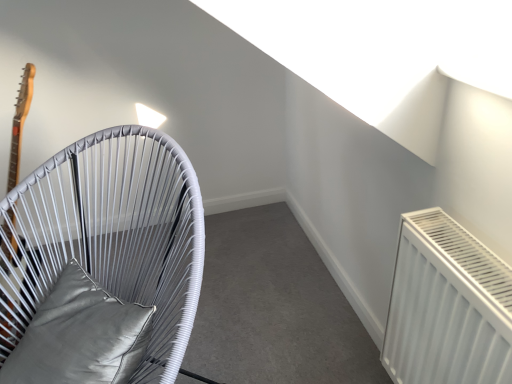
The height and width of the screenshot is (384, 512). I want to click on satin gray pillow at left, so click(80, 336).

What do you see at coordinates (80, 336) in the screenshot? Image resolution: width=512 pixels, height=384 pixels. I see `satin gray pillow at left` at bounding box center [80, 336].

The height and width of the screenshot is (384, 512). Identify the location of white woven chair at left. (109, 237).

The height and width of the screenshot is (384, 512). Describe the element at coordinates (109, 237) in the screenshot. I see `white woven chair at left` at that location.

Find the location of a particular element. The height and width of the screenshot is (384, 512). satin gray pillow at left is located at coordinates (80, 336).

Does satin gray pillow at left appear on the right side of white woven chair at left?

Yes, satin gray pillow at left is to the right of white woven chair at left.

Looking at this image, considering their positions, is satin gray pillow at left located in front of or behind white woven chair at left?

Visually, satin gray pillow at left is located behind white woven chair at left.

Which is closer, (1,371) or (179,306)?

Point (179,306)

From the image's perspective, is satin gray pillow at left located above or below white woven chair at left?

Clearly, from the image's perspective, satin gray pillow at left is below white woven chair at left.

From a real-world perspective, is satin gray pillow at left located higher than white woven chair at left?

Yes, from a real-world perspective, satin gray pillow at left is above white woven chair at left.

Between satin gray pillow at left and white woven chair at left, which one has larger width?

Wider between the two is white woven chair at left.

Who is shorter, satin gray pillow at left or white woven chair at left?

Standing shorter between the two is satin gray pillow at left.

Does satin gray pillow at left have a larger size compared to white woven chair at left?

No, satin gray pillow at left is not bigger than white woven chair at left.

Is white woven chair at left completely or partially inside satin gray pillow at left?

That's incorrect, white woven chair at left is not inside satin gray pillow at left.

From the picture: Is there a large distance between satin gray pillow at left and white woven chair at left?

No, satin gray pillow at left is not far from white woven chair at left.

Is satin gray pillow at left oriented away from white woven chair at left?

Absolutely, satin gray pillow at left is directed away from white woven chair at left.

How many degrees apart are the facing directions of satin gray pillow at left and white woven chair at left?

The angular difference between satin gray pillow at left and white woven chair at left is 11.2 degrees.

I want to click on pillow above the white woven chair at left (from a real-world perspective), so click(80, 336).

Does white woven chair at left appear on the right side of satin gray pillow at left?

In fact, white woven chair at left is to the left of satin gray pillow at left.

In the image, is white woven chair at left positioned in front of or behind satin gray pillow at left?

In the image, white woven chair at left appears in front of satin gray pillow at left.

Which is farther, (119, 231) or (52, 301)?

The point (119, 231) is farther from the camera.

From the image's perspective, which one is positioned higher, white woven chair at left or satin gray pillow at left?

white woven chair at left, from the image's perspective.

Consider the image. From a real-world perspective, is white woven chair at left on top of satin gray pillow at left?

No, from a real-world perspective, white woven chair at left is not over satin gray pillow at left

Is white woven chair at left wider or thinner than satin gray pillow at left?

white woven chair at left is wider than satin gray pillow at left.

Between white woven chair at left and satin gray pillow at left, which one has less height?

satin gray pillow at left is shorter.

Considering the relative sizes of white woven chair at left and satin gray pillow at left in the image provided, is white woven chair at left smaller than satin gray pillow at left?

Incorrect, white woven chair at left is not smaller in size than satin gray pillow at left.

Is white woven chair at left not inside satin gray pillow at left?

Yes.

Can you see white woven chair at left touching satin gray pillow at left?

No, white woven chair at left is not beside satin gray pillow at left.

Is white woven chair at left oriented towards satin gray pillow at left?

Yes, white woven chair at left is oriented towards satin gray pillow at left.

How many degrees apart are the facing directions of white woven chair at left and satin gray pillow at left?

They differ by 11.2 degrees in their facing directions.

How much distance is there between white woven chair at left and satin gray pillow at left?

13.23 centimeters.

In the image, there is a satin gray pillow at left. What are the coordinates of `furniture below it (from a real-world perspective)` in the screenshot? It's located at (109, 237).

Where is `pillow above the white woven chair at left (from a real-world perspective)`? This screenshot has width=512, height=384. pillow above the white woven chair at left (from a real-world perspective) is located at coordinates (80, 336).

Image resolution: width=512 pixels, height=384 pixels. Identify the location of furniture in front of the satin gray pillow at left. (109, 237).